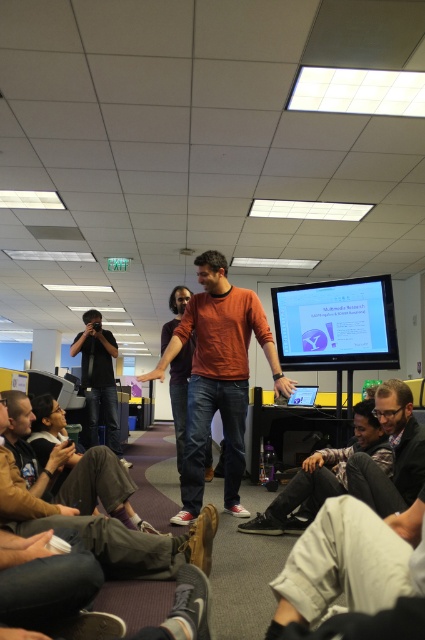
You are a photographer who needs to capture a closeup shot of the dark gray jeans at lower center using the black matte camera at left. Can you do this without moving either the camera or the jeans?

The dark gray jeans at lower center and black matte camera at left are 2.84 meters apart from each other. Since the camera is fixed in position and the jeans are 2.84 meters away, you can adjust the camera settings to focus on the subject from that distance and capture the closeup shot without needing to move either object.